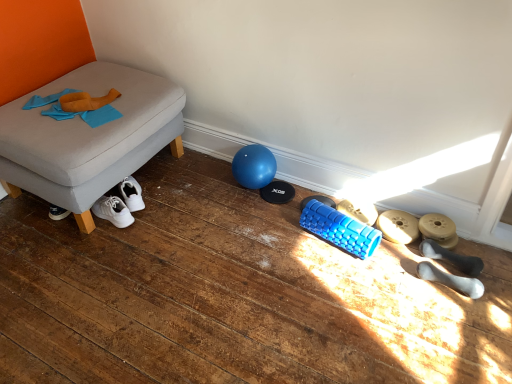
Locate an element on the screen. This screenshot has height=384, width=512. free space to the left of matte gold dumbbell at lower right, positioned as the 3th footwear in back-to-front order is located at coordinates (396, 261).